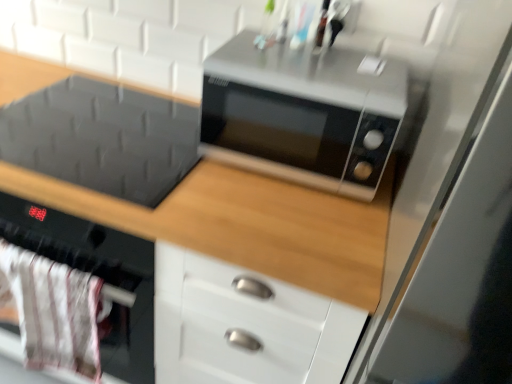
Question: From a real-world perspective, is transparent glass door at right below matte black microwave at upper center?

Choices:
 (A) no
 (B) yes

Answer: (A)

Question: From a real-world perspective, is transparent glass door at right physically above matte black microwave at upper center?

Choices:
 (A) no
 (B) yes

Answer: (B)

Question: Does transparent glass door at right lie behind matte black microwave at upper center?

Choices:
 (A) no
 (B) yes

Answer: (A)

Question: From the image's perspective, is transparent glass door at right under matte black microwave at upper center?

Choices:
 (A) no
 (B) yes

Answer: (B)

Question: Does transparent glass door at right turn towards matte black microwave at upper center?

Choices:
 (A) no
 (B) yes

Answer: (A)

Question: From the image's perspective, is white fabric oven at lower left positioned above or below satin silver microwave at center?

Choices:
 (A) above
 (B) below

Answer: (B)

Question: Would you say white fabric oven at lower left is inside or outside satin silver microwave at center?

Choices:
 (A) inside
 (B) outside

Answer: (B)

Question: In the image, is white fabric oven at lower left on the left side or the right side of satin silver microwave at center?

Choices:
 (A) right
 (B) left

Answer: (B)

Question: Is white fabric oven at lower left wider or thinner than satin silver microwave at center?

Choices:
 (A) wide
 (B) thin

Answer: (B)

Question: Considering the positions of white fabric oven at lower left and matte black microwave at upper center in the image, is white fabric oven at lower left taller or shorter than matte black microwave at upper center?

Choices:
 (A) short
 (B) tall

Answer: (A)

Question: From a real-world perspective, is white fabric oven at lower left above or below matte black microwave at upper center?

Choices:
 (A) above
 (B) below

Answer: (A)

Question: Visually, is white fabric oven at lower left positioned to the left or to the right of matte black microwave at upper center?

Choices:
 (A) right
 (B) left

Answer: (B)

Question: Do you think white fabric oven at lower left is within matte black microwave at upper center, or outside of it?

Choices:
 (A) inside
 (B) outside

Answer: (B)

Question: Considering the positions of satin silver microwave at center and matte black microwave at upper center in the image, is satin silver microwave at center taller or shorter than matte black microwave at upper center?

Choices:
 (A) tall
 (B) short

Answer: (B)

Question: Relative to matte black microwave at upper center, is satin silver microwave at center in front or behind?

Choices:
 (A) front
 (B) behind

Answer: (B)